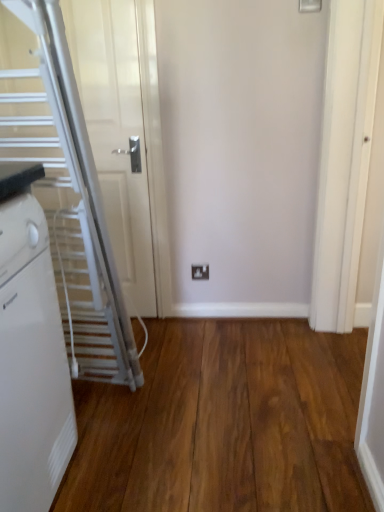
Question: Is white plastic radiator at left placed right next to white plastic electric outlet at center?

Choices:
 (A) no
 (B) yes

Answer: (A)

Question: Considering the relative sizes of white plastic radiator at left and white plastic electric outlet at center in the image provided, is white plastic radiator at left smaller than white plastic electric outlet at center?

Choices:
 (A) yes
 (B) no

Answer: (B)

Question: Does white plastic radiator at left have a greater height compared to white plastic electric outlet at center?

Choices:
 (A) yes
 (B) no

Answer: (A)

Question: Is white plastic radiator at left further to camera compared to white plastic electric outlet at center?

Choices:
 (A) yes
 (B) no

Answer: (B)

Question: Is white plastic radiator at left facing towards white plastic electric outlet at center?

Choices:
 (A) yes
 (B) no

Answer: (B)

Question: Is white metallic escalator at left inside or outside of white plastic radiator at left?

Choices:
 (A) inside
 (B) outside

Answer: (B)

Question: From their relative heights in the image, would you say white metallic escalator at left is taller or shorter than white plastic radiator at left?

Choices:
 (A) tall
 (B) short

Answer: (A)

Question: Considering the positions of point (69, 198) and point (23, 364), is point (69, 198) closer or farther from the camera than point (23, 364)?

Choices:
 (A) closer
 (B) farther

Answer: (B)

Question: Is white metallic escalator at left wider or thinner than white plastic radiator at left?

Choices:
 (A) wide
 (B) thin

Answer: (B)

Question: Is white plastic radiator at left wider or thinner than brown wood flooring at center?

Choices:
 (A) thin
 (B) wide

Answer: (A)

Question: In terms of height, does white plastic radiator at left look taller or shorter compared to brown wood flooring at center?

Choices:
 (A) tall
 (B) short

Answer: (A)

Question: In terms of size, does white plastic radiator at left appear bigger or smaller than brown wood flooring at center?

Choices:
 (A) big
 (B) small

Answer: (A)

Question: Based on their positions, is white plastic radiator at left located to the left or right of brown wood flooring at center?

Choices:
 (A) left
 (B) right

Answer: (A)

Question: Is white plastic radiator at left wider or thinner than white plastic electric outlet at center?

Choices:
 (A) thin
 (B) wide

Answer: (B)

Question: Is white plastic radiator at left in front of or behind white plastic electric outlet at center in the image?

Choices:
 (A) front
 (B) behind

Answer: (A)